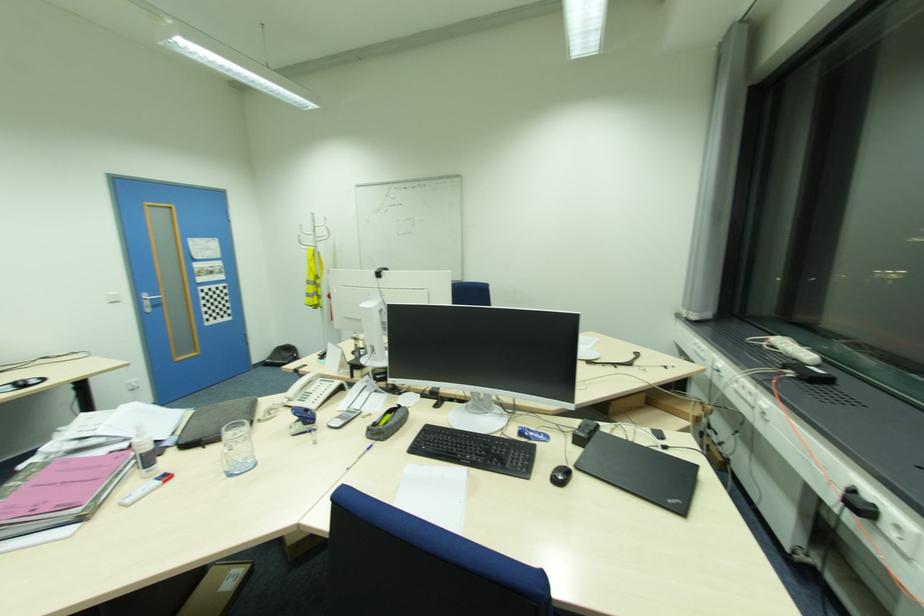
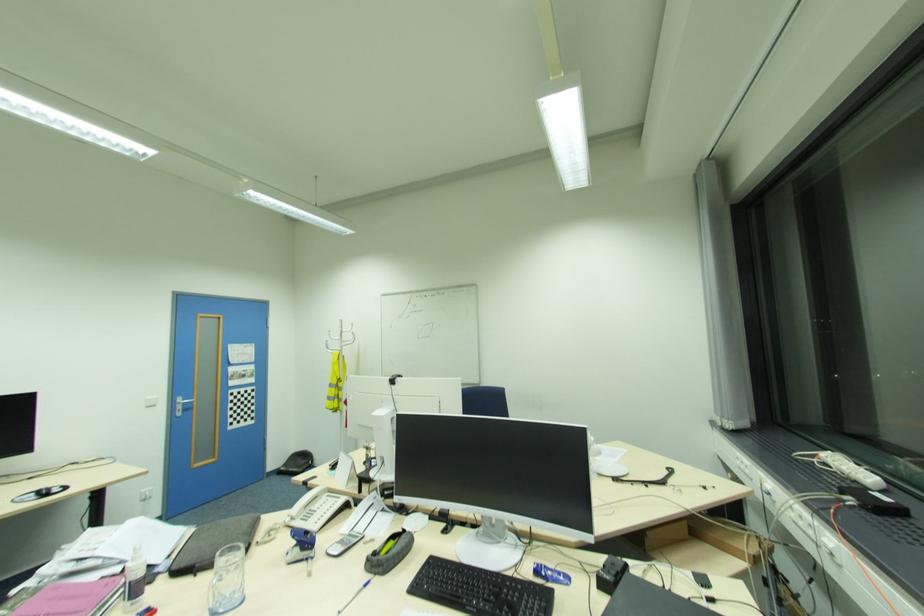
Question: Based on the continuous images, in which direction is the camera rotating? Reply with the corresponding letter.

Choices:
 (A) Left
 (B) Right
 (C) Up
 (D) Down

Answer: (C)